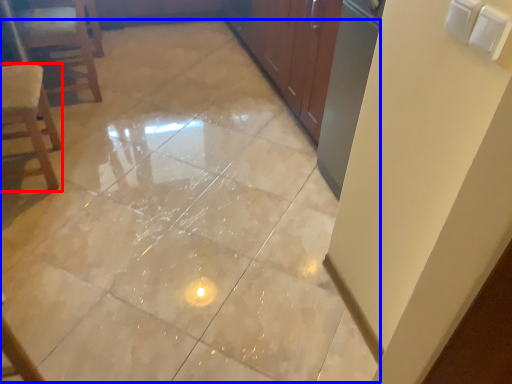
Question: Which object appears closest to the camera in this image, chair (highlighted by a red box) or ceramic tile (highlighted by a blue box)?

Choices:
 (A) chair
 (B) ceramic tile

Answer: (B)